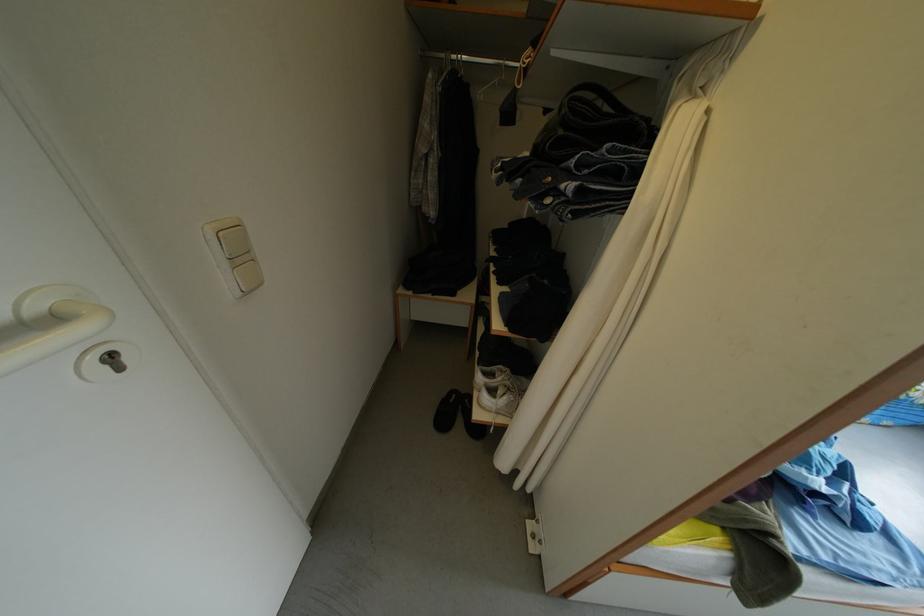
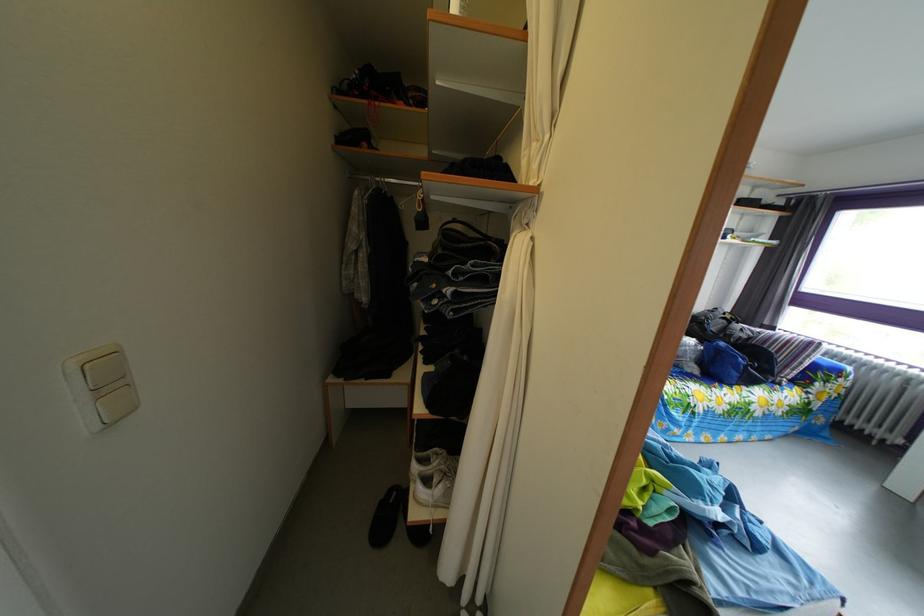
In a continuous first-person perspective shot, in which direction is the camera moving?

The cameraman walked toward right, backward.